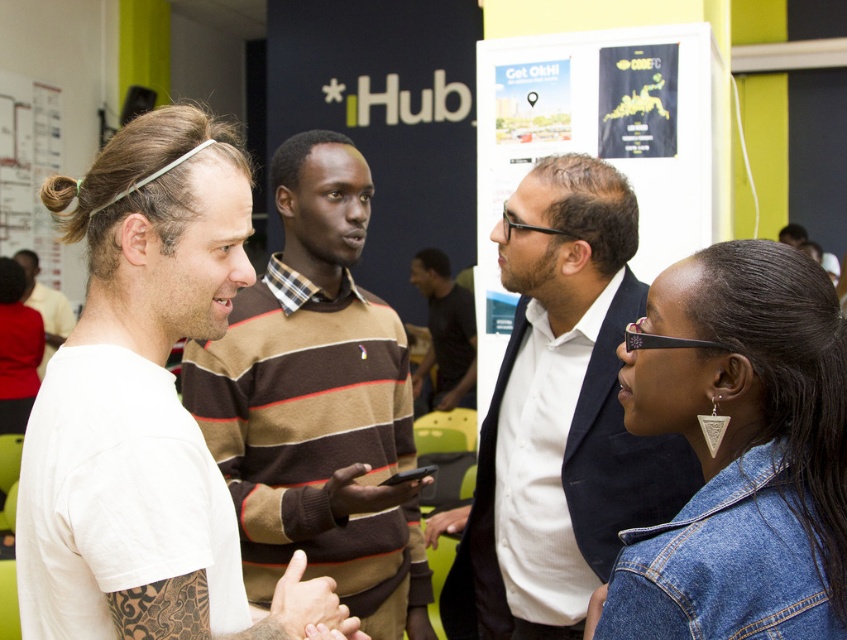
You are standing in the iHub office and notice two points marked on the whiteboard. The first point is at coordinates (347, 262) and the second at (429, 364). If you were to walk towards the whiteboard, which point would appear closer to you?

Point (347, 262) is closer to the camera than point (429, 364), so when you walk towards the whiteboard, point (347, 262) would appear closer to you.

You are standing in the iHub office and need to approach the whiteboard to take notes. There are two people in front of you wearing a dark blue suit at center and a black matte shirt at center. Which person should you go around to reach the whiteboard?

The dark blue suit at center is in front of the black matte shirt at center, so you should go around the dark blue suit at center to reach the whiteboard.